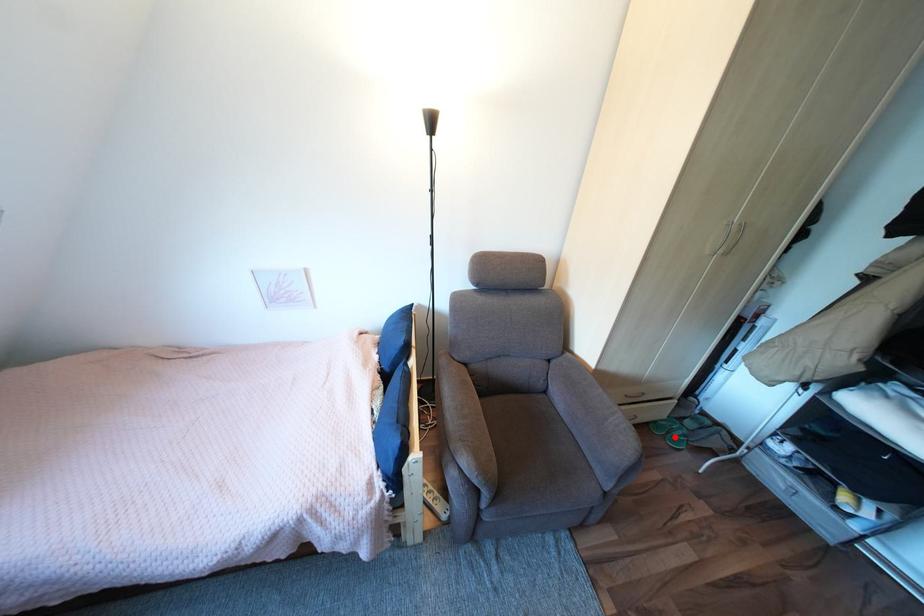
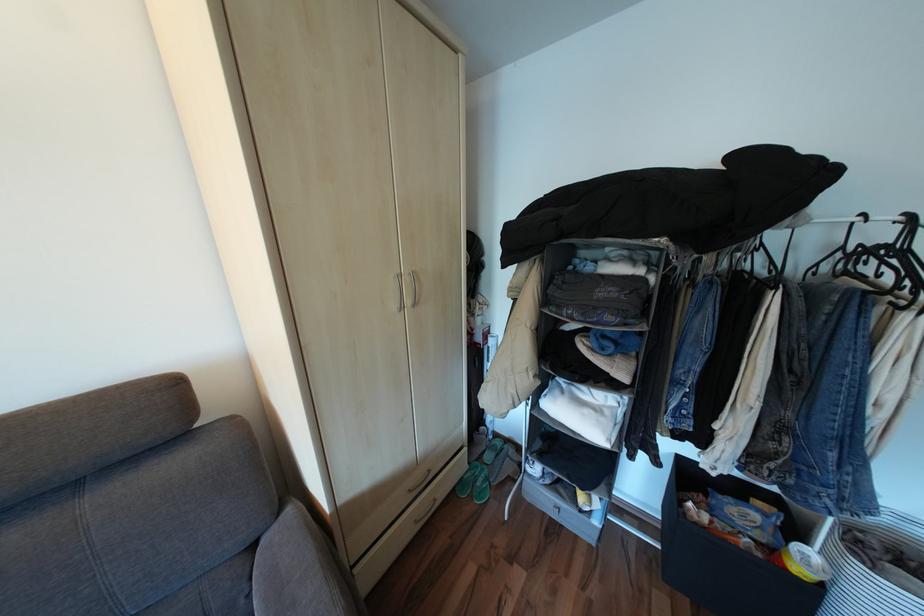
In the second image, find the point that corresponds to the highlighted location in the first image.

(481, 496)